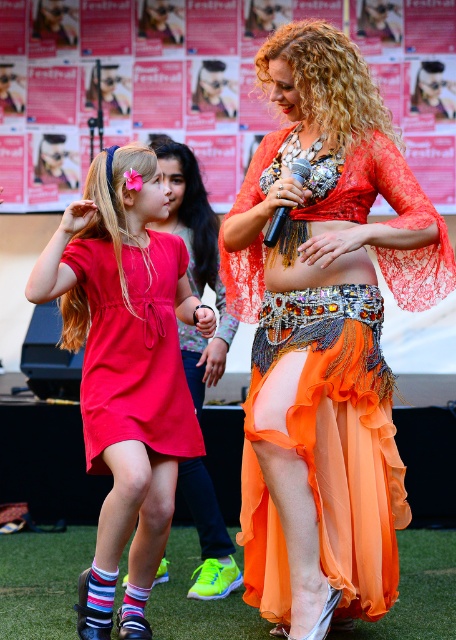
From the picture: You are standing in the festival scene and want to place a small decoration between the two points, point (x=174, y=198) and point (x=279, y=230). Which point should the decoration be closer to in order to be closer to the viewer?

The decoration should be closer to point (x=174, y=198) because it is closer to the viewer compared to point (x=279, y=230).

You are at a festival and see two people wearing a matte red dress at center and a matte red dress at left. Which one is positioned lower in the image?

The matte red dress at center is positioned lower than the matte red dress at left.

You are a photographer at the festival trying to capture the belly dancer. You notice two orange items at the center of the image. Which one is closer to you, the shiny orange fabric at center or the orange chiffon dress at center?

The shiny orange fabric at center is closer to you because it is in front of the orange chiffon dress at center.